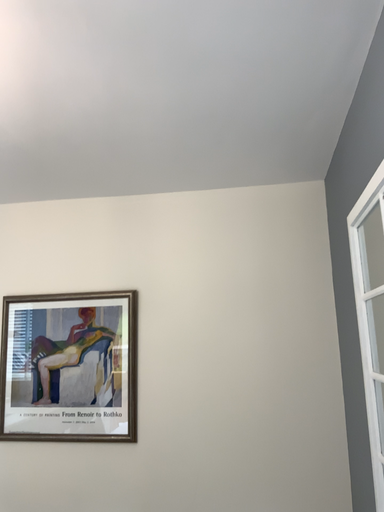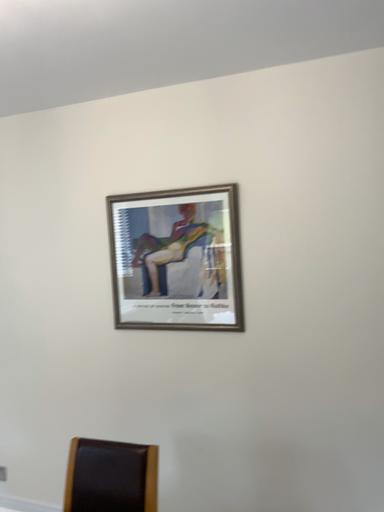
Question: Which way did the camera rotate in the video?

Choices:
 (A) rotated downward
 (B) rotated upward

Answer: (A)